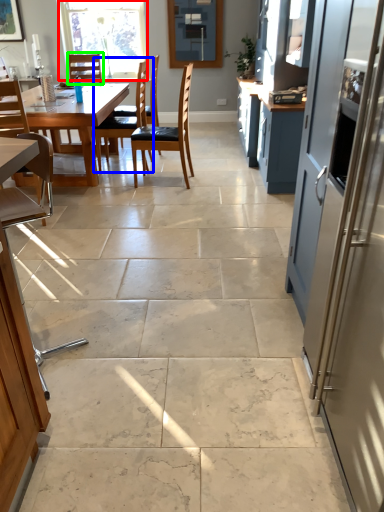
Question: Which object is the farthest from window (highlighted by a red box)? Choose among these: chair (highlighted by a blue box) or chair (highlighted by a green box).

Choices:
 (A) chair
 (B) chair

Answer: (A)